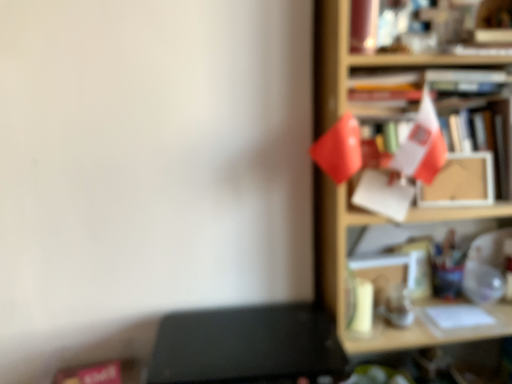
Question: From the image's perspective, relative to wooden shelf at right, is black matte writing desk at lower left above or below?

Choices:
 (A) below
 (B) above

Answer: (A)

Question: In terms of height, does black matte writing desk at lower left look taller or shorter compared to wooden shelf at right?

Choices:
 (A) tall
 (B) short

Answer: (B)

Question: Based on their sizes in the image, would you say black matte writing desk at lower left is bigger or smaller than wooden shelf at right?

Choices:
 (A) big
 (B) small

Answer: (B)

Question: In the image, is wooden shelf at right on the left side or the right side of black matte writing desk at lower left?

Choices:
 (A) right
 (B) left

Answer: (A)

Question: From the image's perspective, is wooden shelf at right positioned above or below black matte writing desk at lower left?

Choices:
 (A) below
 (B) above

Answer: (B)

Question: Considering the positions of wooden shelf at right and black matte writing desk at lower left in the image, is wooden shelf at right wider or thinner than black matte writing desk at lower left?

Choices:
 (A) wide
 (B) thin

Answer: (B)

Question: Is wooden shelf at right taller or shorter than black matte writing desk at lower left?

Choices:
 (A) short
 (B) tall

Answer: (B)